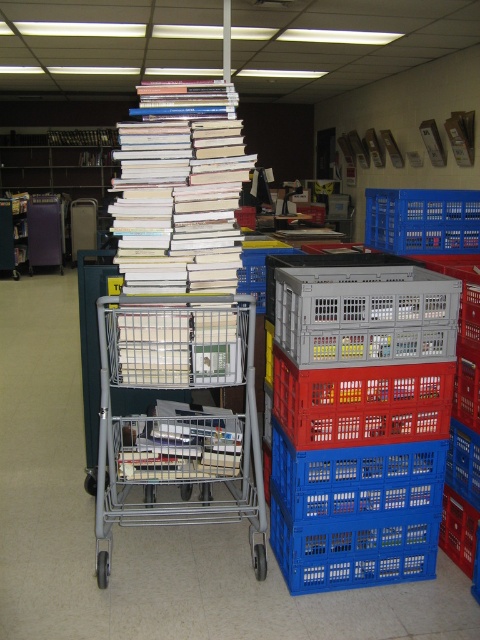
Question: Which object is the closest to the blue plastic basket at lower right?

Choices:
 (A) blue plastic crate at lower right
 (B) red plastic crate at center
 (C) metallic silver shopping cart at center

Answer: (B)

Question: Can you confirm if blue plastic basket at lower right is wider than metallic gray basket at center?

Choices:
 (A) yes
 (B) no

Answer: (A)

Question: Considering the relative positions of blue plastic crate at center and blue plastic crate at lower right in the image provided, where is blue plastic crate at center located with respect to blue plastic crate at lower right?

Choices:
 (A) left
 (B) right

Answer: (A)

Question: Which point appears closest to the camera in this image?

Choices:
 (A) (471, 432)
 (B) (322, 458)
 (C) (398, 204)
 (D) (398, 436)

Answer: (B)

Question: Based on their relative distances, which object is nearer to the blue plastic crate at lower right?

Choices:
 (A) metallic silver shopping cart at center
 (B) metallic gray basket at center
 (C) blue plastic crate at center
 (D) blue plastic basket at lower center

Answer: (D)

Question: Is blue plastic basket at lower right thinner than blue plastic crate at center?

Choices:
 (A) yes
 (B) no

Answer: (B)